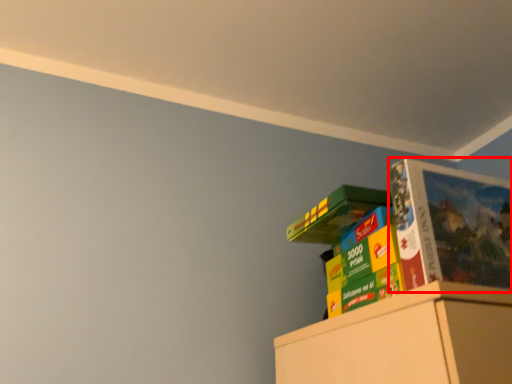
Question: From the image's perspective, where is paperback book (annotated by the red box) located relative to book?

Choices:
 (A) below
 (B) above

Answer: (B)